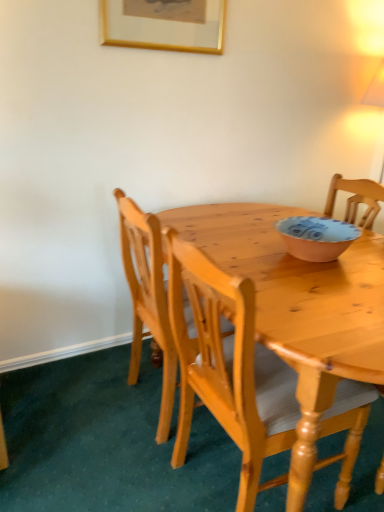
Question: Does gold-framed picture at upper center have a lesser height compared to light brown wooden chair at center, acting as the 2th chair starting from the back?

Choices:
 (A) no
 (B) yes

Answer: (B)

Question: Is light brown wooden chair at center, the first chair positioned from the front, surrounded by gold-framed picture at upper center?

Choices:
 (A) yes
 (B) no

Answer: (B)

Question: Are gold-framed picture at upper center and light brown wooden chair at center, acting as the 2th chair starting from the back, far apart?

Choices:
 (A) yes
 (B) no

Answer: (A)

Question: From the image's perspective, is gold-framed picture at upper center beneath light brown wooden chair at center, the first chair positioned from the front?

Choices:
 (A) yes
 (B) no

Answer: (B)

Question: Is gold-framed picture at upper center outside of light brown wooden chair at center, acting as the 2th chair starting from the back?

Choices:
 (A) no
 (B) yes

Answer: (B)

Question: From a real-world perspective, is light brown wooden chair at center, acting as the 1th chair starting from the back, physically located above or below gold-framed picture at upper center?

Choices:
 (A) below
 (B) above

Answer: (A)

Question: Based on their sizes in the image, would you say light brown wooden chair at center, the second chair when ordered from front to back, is bigger or smaller than gold-framed picture at upper center?

Choices:
 (A) big
 (B) small

Answer: (A)

Question: In terms of height, does light brown wooden chair at center, acting as the 1th chair starting from the back, look taller or shorter compared to gold-framed picture at upper center?

Choices:
 (A) tall
 (B) short

Answer: (A)

Question: Is light brown wooden chair at center, acting as the 1th chair starting from the back, to the left or to the right of gold-framed picture at upper center in the image?

Choices:
 (A) right
 (B) left

Answer: (A)

Question: Considering the positions of light brown wooden chair at center, acting as the 1th chair starting from the back, and matte pink bowl at center in the image, is light brown wooden chair at center, acting as the 1th chair starting from the back, taller or shorter than matte pink bowl at center?

Choices:
 (A) tall
 (B) short

Answer: (A)

Question: From a real-world perspective, relative to matte pink bowl at center, is light brown wooden chair at center, acting as the 1th chair starting from the back, vertically above or below?

Choices:
 (A) below
 (B) above

Answer: (A)

Question: From the image's perspective, is light brown wooden chair at center, the second chair when ordered from front to back, above or below matte pink bowl at center?

Choices:
 (A) above
 (B) below

Answer: (B)

Question: Is point (167, 380) closer or farther from the camera than point (317, 229)?

Choices:
 (A) farther
 (B) closer

Answer: (B)

Question: From a real-world perspective, is matte pink bowl at center positioned above or below gold-framed picture at upper center?

Choices:
 (A) above
 (B) below

Answer: (B)

Question: In terms of height, does matte pink bowl at center look taller or shorter compared to gold-framed picture at upper center?

Choices:
 (A) short
 (B) tall

Answer: (A)